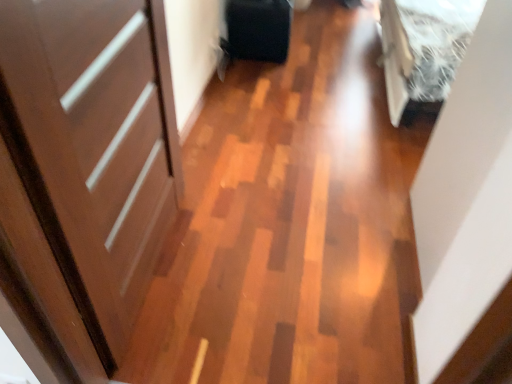
Question: Does matte black suitcase at center have a lesser width compared to matte brown door at left?

Choices:
 (A) no
 (B) yes

Answer: (A)

Question: From a real-world perspective, is matte black suitcase at center on matte brown door at left?

Choices:
 (A) yes
 (B) no

Answer: (B)

Question: Is the depth of matte black suitcase at center less than that of matte brown door at left?

Choices:
 (A) yes
 (B) no

Answer: (B)

Question: Does matte black suitcase at center have a smaller size compared to matte brown door at left?

Choices:
 (A) yes
 (B) no

Answer: (A)

Question: From a real-world perspective, is matte black suitcase at center physically below matte brown door at left?

Choices:
 (A) yes
 (B) no

Answer: (A)

Question: Is matte black suitcase at center taller than matte brown door at left?

Choices:
 (A) no
 (B) yes

Answer: (A)

Question: Would you say matte brown door at left contains white fluffy bed at upper right?

Choices:
 (A) yes
 (B) no

Answer: (B)

Question: Is matte brown door at left smaller than white fluffy bed at upper right?

Choices:
 (A) no
 (B) yes

Answer: (B)

Question: From the image's perspective, is matte brown door at left on top of white fluffy bed at upper right?

Choices:
 (A) yes
 (B) no

Answer: (B)

Question: Does matte brown door at left come in front of white fluffy bed at upper right?

Choices:
 (A) no
 (B) yes

Answer: (B)

Question: Considering the relative sizes of matte brown door at left and white fluffy bed at upper right in the image provided, is matte brown door at left shorter than white fluffy bed at upper right?

Choices:
 (A) yes
 (B) no

Answer: (B)

Question: From a real-world perspective, is matte brown door at left on white fluffy bed at upper right?

Choices:
 (A) yes
 (B) no

Answer: (A)

Question: From the image's perspective, is white fluffy bed at upper right under matte brown door at left?

Choices:
 (A) no
 (B) yes

Answer: (A)